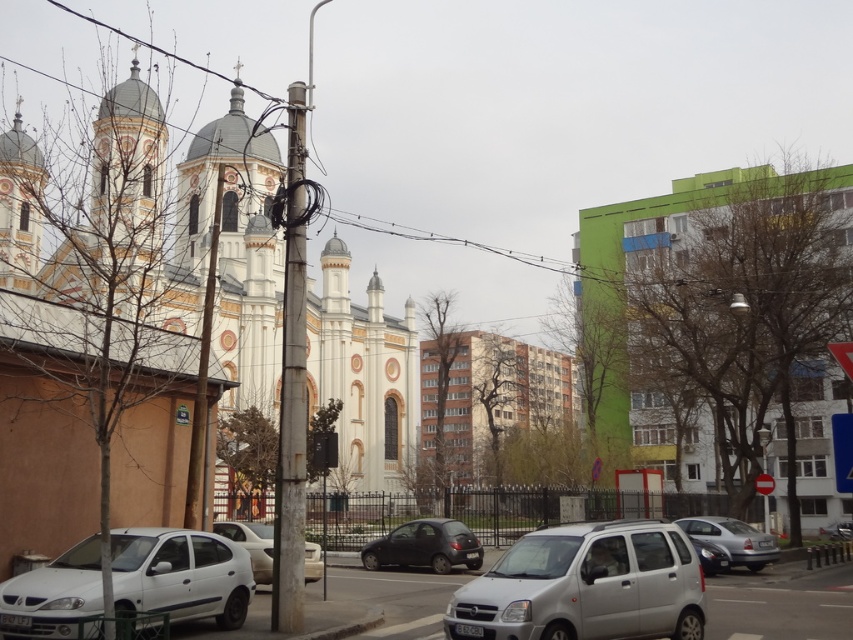
Question: Considering the real-world distances, which object is farthest from the white stone church at left?

Choices:
 (A) silver metallic hatchback at center
 (B) green matte building at right

Answer: (A)

Question: Which point is farther to the camera?

Choices:
 (A) silver metallic van at center
 (B) white matte car at center

Answer: (B)

Question: Is the position of rusty metal pole at center less distant than that of matte black car at center?

Choices:
 (A) no
 (B) yes

Answer: (B)

Question: Which object is the farthest from the rusty metal pole at center?

Choices:
 (A) silver metallic van at center
 (B) silver metallic hatchback at center

Answer: (B)

Question: Where is silver metallic van at center located in relation to matte black car at center in the image?

Choices:
 (A) above
 (B) below

Answer: (A)

Question: Is white stone church at left behind white matte car at center?

Choices:
 (A) yes
 (B) no

Answer: (A)